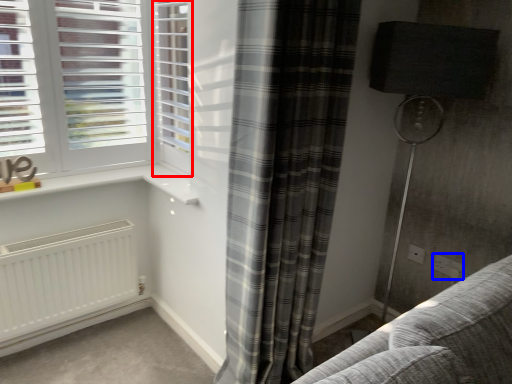
Question: Which object is closer to the camera taking this photo, screen door (highlighted by a red box) or electric outlet (highlighted by a blue box)?

Choices:
 (A) screen door
 (B) electric outlet

Answer: (A)